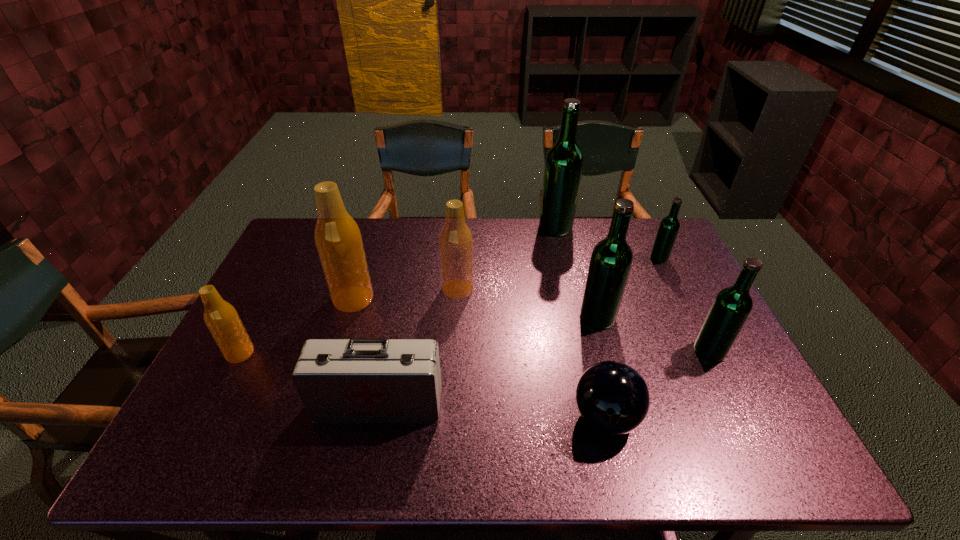
Where is `the farthest beer bottle`? the farthest beer bottle is located at coordinates (564, 161).

Identify the location of the farthest green beer bottle. This screenshot has height=540, width=960. (564, 161).

Where is `the third smallest green beer bottle`? the third smallest green beer bottle is located at coordinates (611, 260).

Where is `the biggest tan beer bottle`? This screenshot has width=960, height=540. the biggest tan beer bottle is located at coordinates (338, 239).

This screenshot has width=960, height=540. What are the coordinates of `the sixth beer bottle from right to left` in the screenshot? It's located at (338, 239).

The height and width of the screenshot is (540, 960). I want to click on the second smallest green beer bottle, so click(731, 307).

Where is `the third beer bottle from left to right`? the third beer bottle from left to right is located at coordinates (455, 241).

The image size is (960, 540). What are the coordinates of `the rightmost tan beer bottle` in the screenshot? It's located at (455, 241).

Locate an element on the screen. This screenshot has height=540, width=960. the smallest green beer bottle is located at coordinates (669, 226).

This screenshot has width=960, height=540. Identify the location of the second farthest green beer bottle. (669, 226).